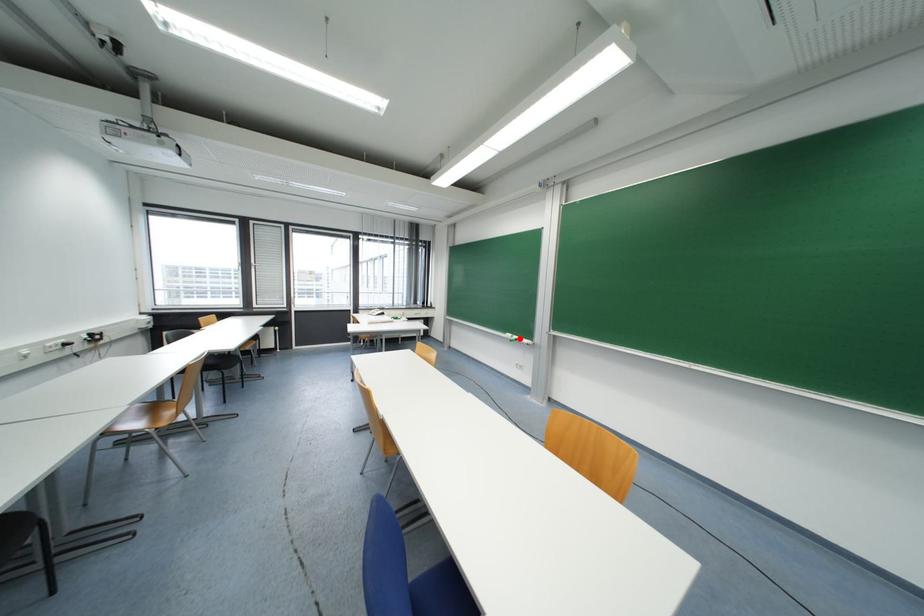
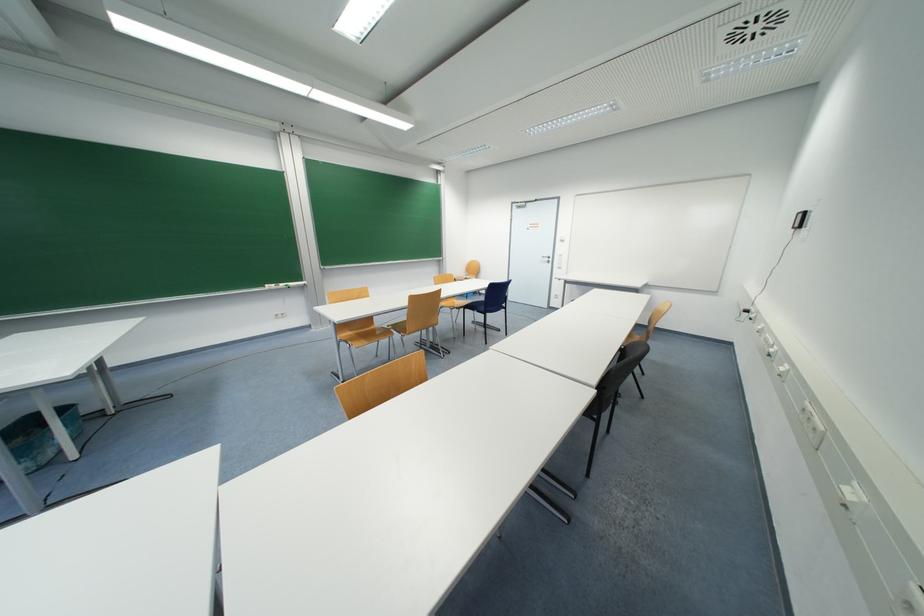
Question: I am providing you with two images of the same scene from different viewpoints. In image1, a red point is highlighted. Considering the same 3D point in image2, which of the following is correct?

Choices:
 (A) It is closer
 (B) It is farther

Answer: (A)